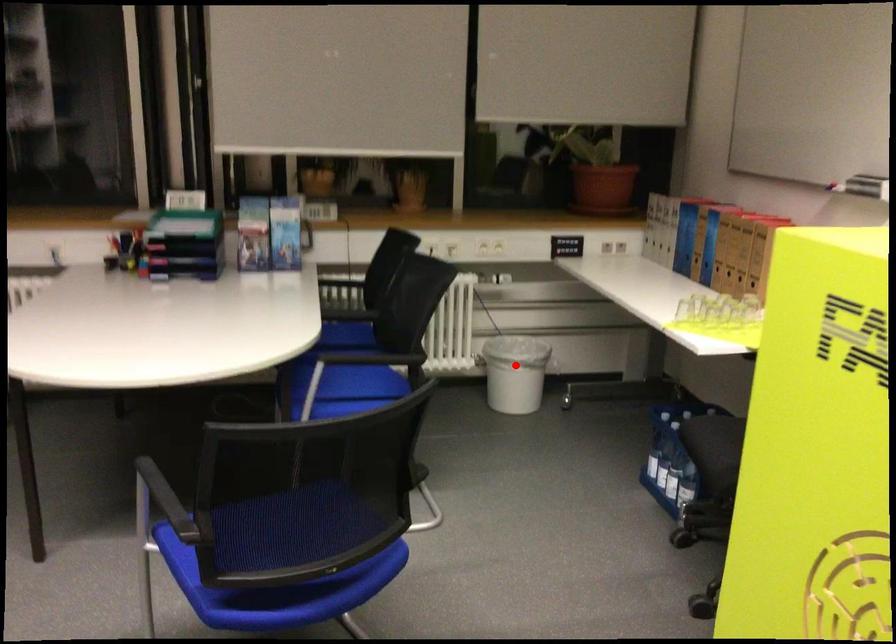
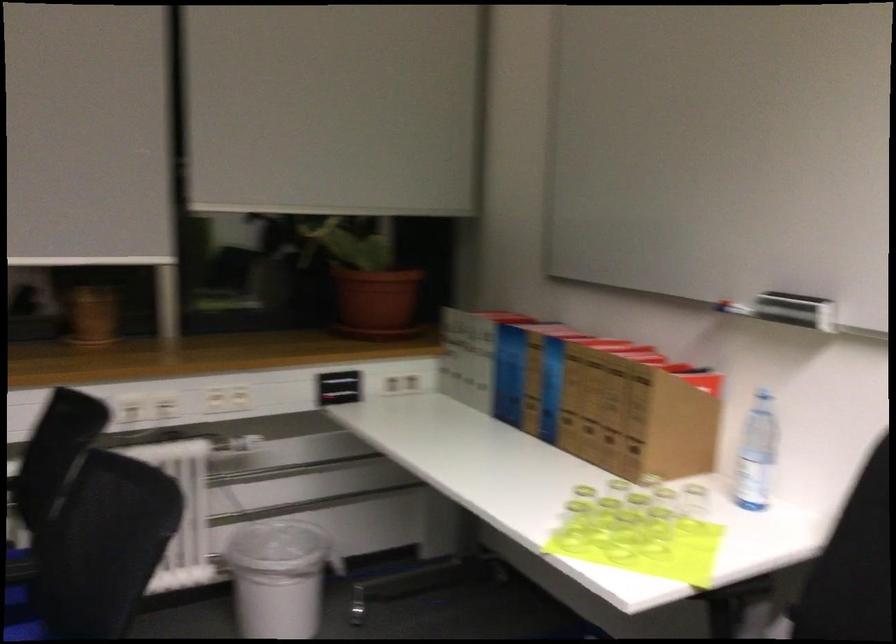
Find the pixel in the second image that matches the highlighted location in the first image.

(278, 576)